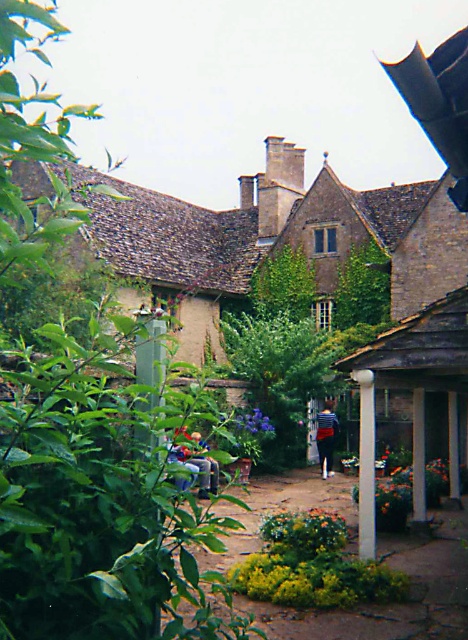
You are a visitor standing in the courtyard and want to take a photo of the white smooth pillar at center and the denim jeans at center. Which object should you focus on first if you want to capture both in a single frame without moving the camera?

You should focus on the white smooth pillar at center first because it is taller than the denim jeans at center, allowing you to frame it properly while ensuring the denim jeans at center remains in the shot.

You are standing in the courtyard and see the striped shirt at center. Based on its position, can you determine if it is placed on the pathway or among the greenery?

The striped shirt at center is located at point coordinates which place it on the pathway since the pathway is in the center of the courtyard as described in the scene.

You are a visitor standing at the entrance of the courtyard. You see a white smooth pillar at center and denim jeans at center. You want to take a photo of the historic building without any obstruction. Which object should you move to ensure the photo is clear?

The white smooth pillar at center is 4.53 meters away from the denim jeans at center. To take a clear photo without obstruction, you should move the denim jeans at center, as it is closer to the camera and blocking the view of the historic building.